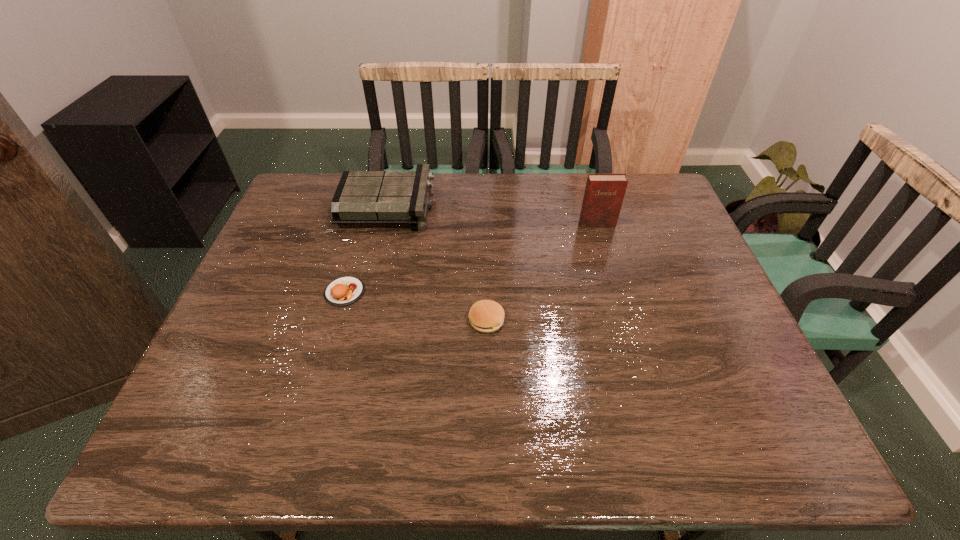
What are the coordinates of `vacant area that lies between the shorter patty (food) and the diary` in the screenshot? It's located at (470, 258).

You are a GUI agent. You are given a task and a screenshot of the screen. Output one action in this format:
    pyautogui.click(x=<x>, y=<y>)
    Task: Click on the vacant area that lies between the left patty (food) and the rightmost object
    The width and height of the screenshot is (960, 540).
    Given the screenshot: What is the action you would take?
    pyautogui.click(x=470, y=258)

Locate an element on the screen. The height and width of the screenshot is (540, 960). free spot between the rightmost object and the third tallest object is located at coordinates (541, 272).

Find the location of a particular element. This screenshot has height=540, width=960. vacant space in between the right patty (food) and the diary is located at coordinates (541, 272).

Find the location of `free space between the second tallest object and the shorter patty (food)`. free space between the second tallest object and the shorter patty (food) is located at coordinates (367, 249).

The width and height of the screenshot is (960, 540). In order to click on free space between the diary and the radio receiver in this screenshot , I will do pos(492,215).

Locate an element on the screen. The width and height of the screenshot is (960, 540). vacant area between the second tallest object and the tallest object is located at coordinates click(x=492, y=215).

Locate an element on the screen. The height and width of the screenshot is (540, 960). vacant space that's between the rightmost object and the shortest object is located at coordinates (470, 258).

Identify the location of vacant area that lies between the diary and the shorter patty (food). The height and width of the screenshot is (540, 960). (x=470, y=258).

Find the location of a particular element. free space that is in between the radio receiver and the diary is located at coordinates (492, 215).